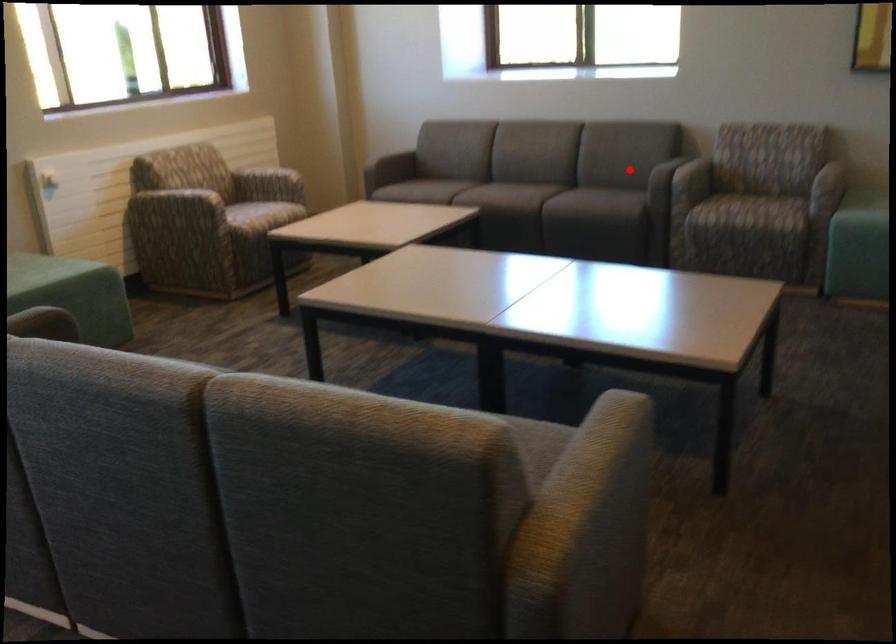
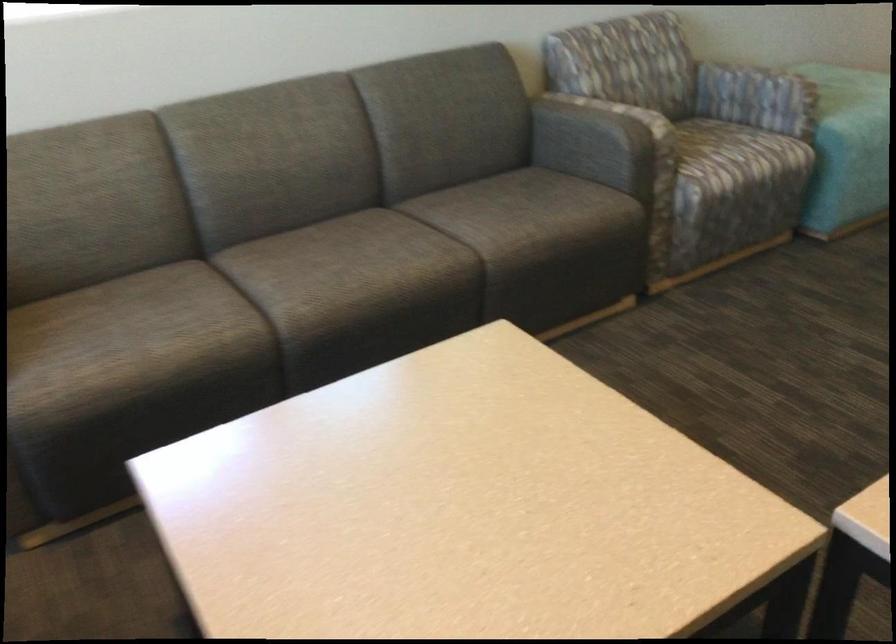
Locate, in the second image, the point that corresponds to the highlighted location in the first image.

(597, 140)